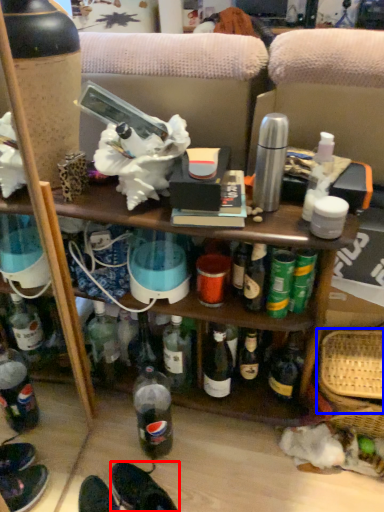
Question: Which point is closer to the camera, footwear (highlighted by a red box) or basket (highlighted by a blue box)?

Choices:
 (A) footwear
 (B) basket

Answer: (A)